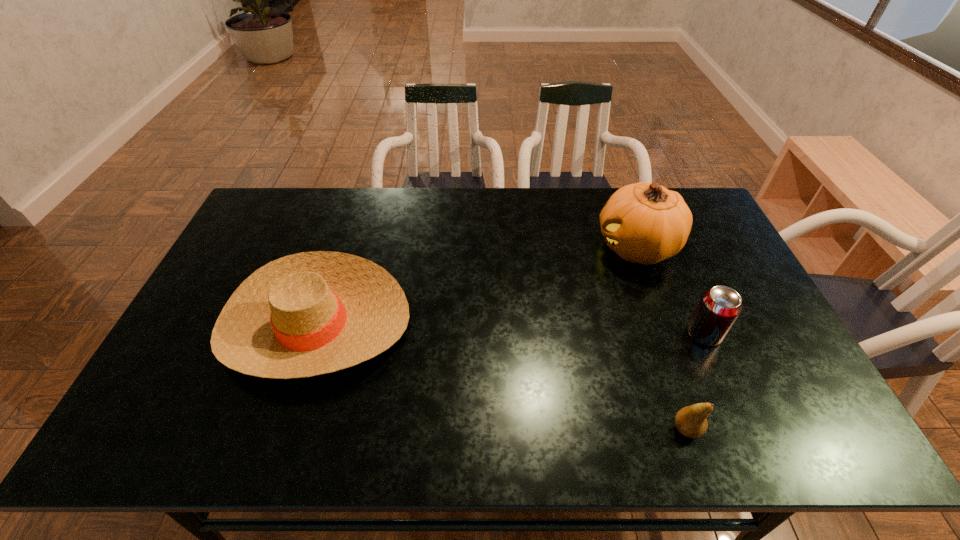
This screenshot has height=540, width=960. What are the coordinates of `the tallest object` in the screenshot? It's located at (646, 223).

Where is `soda can`? soda can is located at coordinates (719, 307).

Find the location of `sunhat`. sunhat is located at coordinates (311, 313).

Locate an element on the screen. pear is located at coordinates (690, 421).

Where is `free space located 0.130m on the front face of the tallest object`? free space located 0.130m on the front face of the tallest object is located at coordinates (555, 247).

Locate an element on the screen. The height and width of the screenshot is (540, 960). free space located 0.180m on the front face of the tallest object is located at coordinates (540, 247).

Where is `vacant space located on the front face of the tallest object`? vacant space located on the front face of the tallest object is located at coordinates (519, 247).

At what (x,y) coordinates should I click in order to perform the action: click on vacant region located on the back of the soda can. Please return your answer as a coordinate pair (x, y). Image resolution: width=960 pixels, height=540 pixels. Looking at the image, I should click on (660, 235).

Identify the location of vacant position located 0.370m on the back of the sunhat. The height and width of the screenshot is (540, 960). tap(356, 200).

Where is `vacant space situated on the left of the nearest object`? The width and height of the screenshot is (960, 540). vacant space situated on the left of the nearest object is located at coordinates (508, 429).